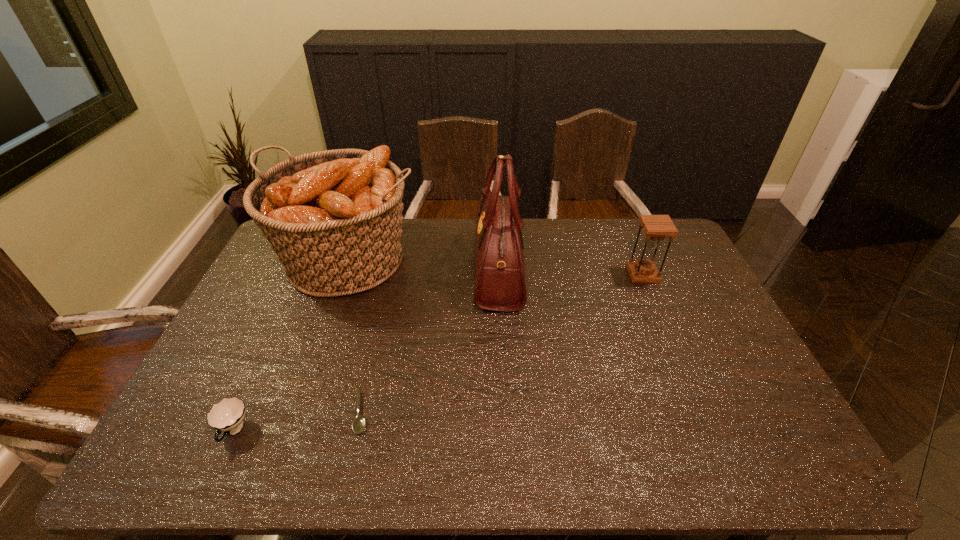
At what (x,y) coordinates should I click in order to perform the action: click on free spot at the far edge of the desktop. Please return your answer as a coordinate pair (x, y). The width and height of the screenshot is (960, 540). Looking at the image, I should click on (457, 235).

This screenshot has height=540, width=960. Identify the location of vacant area at the near edge of the desktop. (249, 451).

At what (x,y) coordinates should I click in order to perform the action: click on vacant space at the left edge. Please return your answer as a coordinate pair (x, y). This screenshot has width=960, height=540. Looking at the image, I should click on (268, 360).

Identify the location of blank space at the right edge of the desktop. The width and height of the screenshot is (960, 540). pyautogui.click(x=703, y=289).

You are a GUI agent. You are given a task and a screenshot of the screen. Output one action in this format:
    pyautogui.click(x=<x>, y=<y>)
    Task: Click on the vacant area between the basket and the handbag
    The image size is (960, 540).
    Given the screenshot: What is the action you would take?
    pyautogui.click(x=423, y=264)

You are a GUI agent. You are given a task and a screenshot of the screen. Output one action in this format:
    pyautogui.click(x=<x>, y=<y>)
    Task: Click on the empty space that is in between the second object from right to left and the cup
    Image resolution: width=960 pixels, height=540 pixels.
    Given the screenshot: What is the action you would take?
    pyautogui.click(x=366, y=349)

This screenshot has height=540, width=960. In order to click on free space between the handbag and the basket in this screenshot , I will do `click(423, 264)`.

Find the location of a particular element. free space between the cup and the soupspoon is located at coordinates (298, 422).

In order to click on vacant area that lies between the handbag and the second shortest object in this screenshot , I will do `click(366, 349)`.

Find the location of a particular element. free space that is in between the basket and the soupspoon is located at coordinates (355, 336).